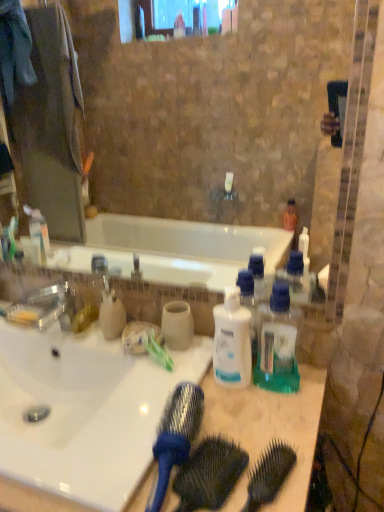
The height and width of the screenshot is (512, 384). I want to click on unoccupied space behind blue plastic comb at center, so click(x=225, y=423).